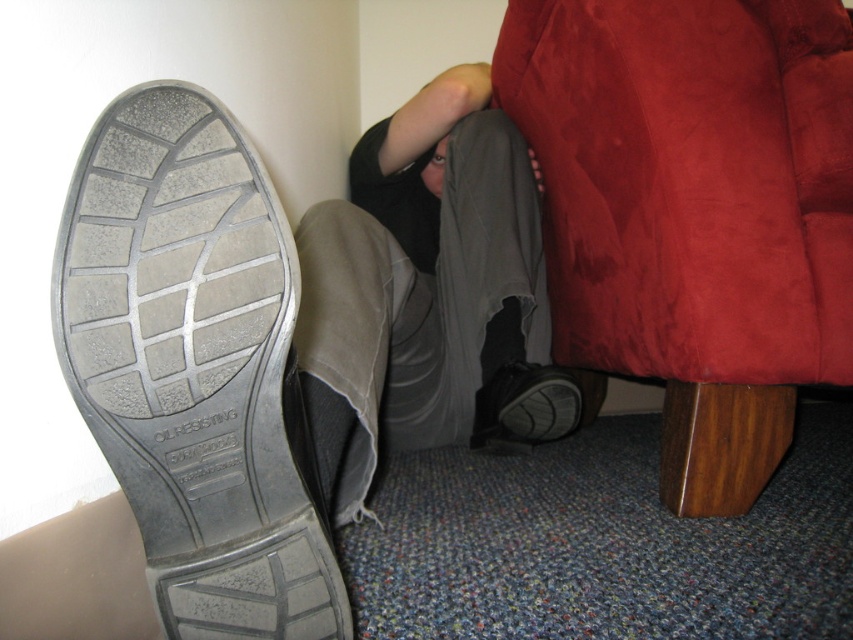
Is gray rubber shoe at lower left bigger than matte gray shoe at lower right?

Answer: Yes, gray rubber shoe at lower left is bigger than matte gray shoe at lower right.

Does point (244, 182) come behind point (508, 413)?

No.

Is point (128, 172) farther from viewer compared to point (529, 435)?

No, (128, 172) is closer to viewer.

Where is `gray rubber shoe at lower left`? The image size is (853, 640). gray rubber shoe at lower left is located at coordinates (196, 365).

Which is more to the left, suede-like red armchair at lower right or smooth skin head at upper center?

Positioned to the left is smooth skin head at upper center.

Who is shorter, suede-like red armchair at lower right or smooth skin head at upper center?

With less height is smooth skin head at upper center.

At what (x,y) coordinates should I click in order to perform the action: click on suede-like red armchair at lower right. Please return your answer as a coordinate pair (x, y). This screenshot has height=640, width=853. Looking at the image, I should click on (694, 211).

Which is above, matte gray shoe at lower right or smooth skin head at upper center?

smooth skin head at upper center is above.

The width and height of the screenshot is (853, 640). Identify the location of matte gray shoe at lower right. pos(524,406).